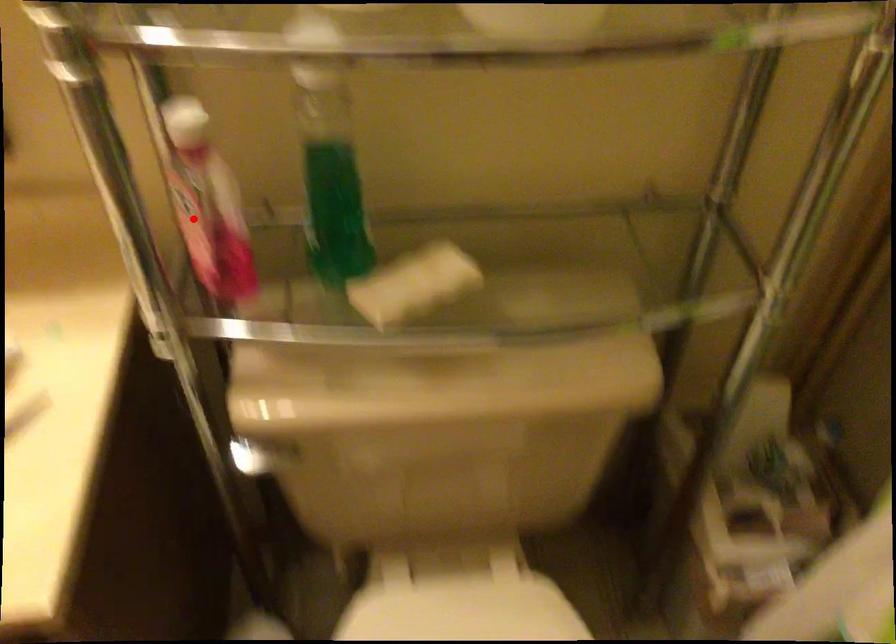
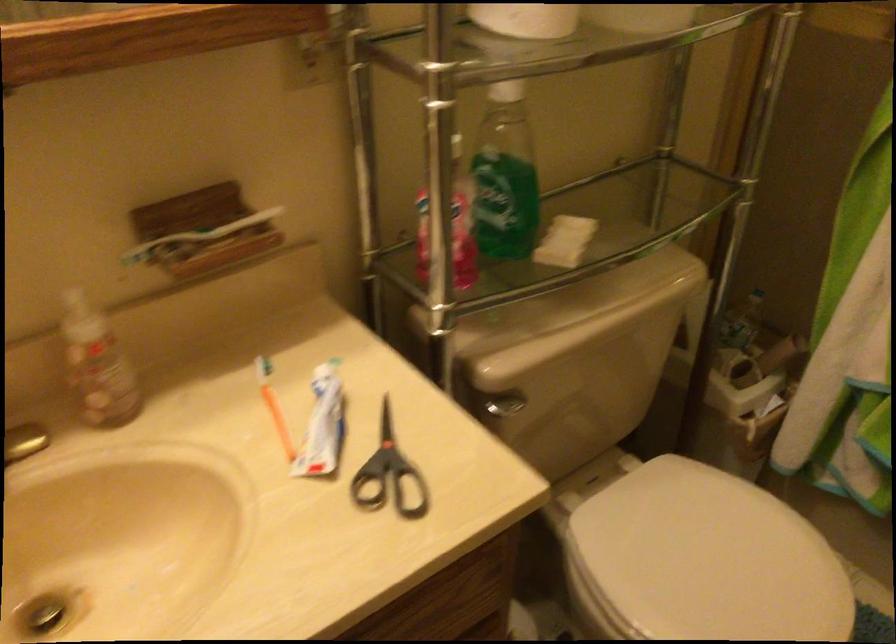
Locate, in the second image, the point that corresponds to the highlighted location in the first image.

(449, 227)